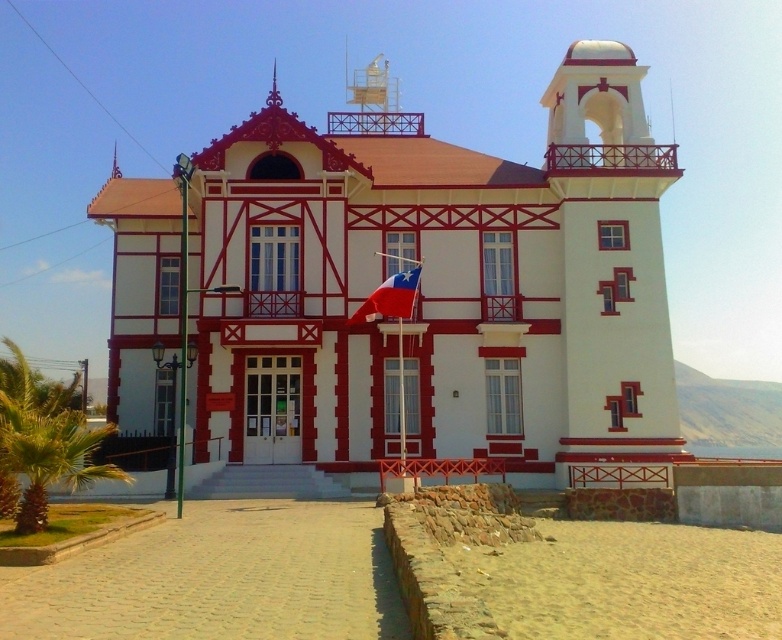
Can you confirm if white painted wood tower at center is positioned above red fabric flag at center?

Indeed, white painted wood tower at center is positioned over red fabric flag at center.

Does white painted wood tower at center come in front of red fabric flag at center?

That is True.

Is point (562, 268) less distant than point (386, 304)?

No, it is not.

The width and height of the screenshot is (782, 640). In order to click on white painted wood tower at center in this screenshot , I will do `click(438, 289)`.

Is the position of white painted wood tower at center less distant than that of green leafy palm tree at lower left?

No, white painted wood tower at center is further to the viewer.

Is point (271, 128) closer to camera compared to point (47, 464)?

No.

The image size is (782, 640). Find the location of `white painted wood tower at center`. white painted wood tower at center is located at coordinates (438, 289).

Does green leafy palm tree at lower left appear over red fabric flag at center?

Incorrect, green leafy palm tree at lower left is not positioned above red fabric flag at center.

Does green leafy palm tree at lower left have a lesser width compared to red fabric flag at center?

No.

Is point (77, 416) closer to viewer compared to point (361, 301)?

Yes, point (77, 416) is closer to viewer.

Identify the location of green leafy palm tree at lower left. The width and height of the screenshot is (782, 640). (45, 438).